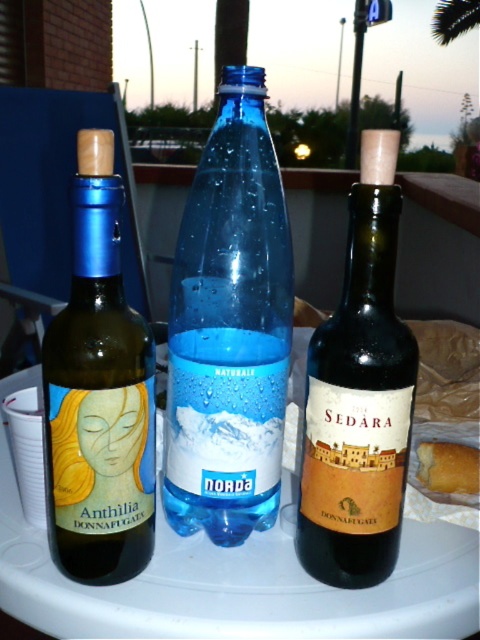
Question: Which point appears farthest from the camera in this image?

Choices:
 (A) (229, 465)
 (B) (432, 472)
 (C) (92, 241)
 (D) (359, 429)

Answer: (B)

Question: Is transparent plastic bottle at center positioned in front of dark brown glass wine at center?

Choices:
 (A) yes
 (B) no

Answer: (B)

Question: Which point is farther from the camera taking this photo?

Choices:
 (A) (218, 228)
 (B) (460, 454)

Answer: (B)

Question: Does matte glass wine at left have a lesser width compared to dark brown glass wine at center?

Choices:
 (A) yes
 (B) no

Answer: (B)

Question: Which object is positioned closest to the golden bread at center?

Choices:
 (A) transparent plastic bottle at center
 (B) matte glass wine at left
 (C) dark brown glass wine at center

Answer: (C)

Question: Can you confirm if transparent plastic bottle at center is positioned below golden bread at center?

Choices:
 (A) no
 (B) yes

Answer: (A)